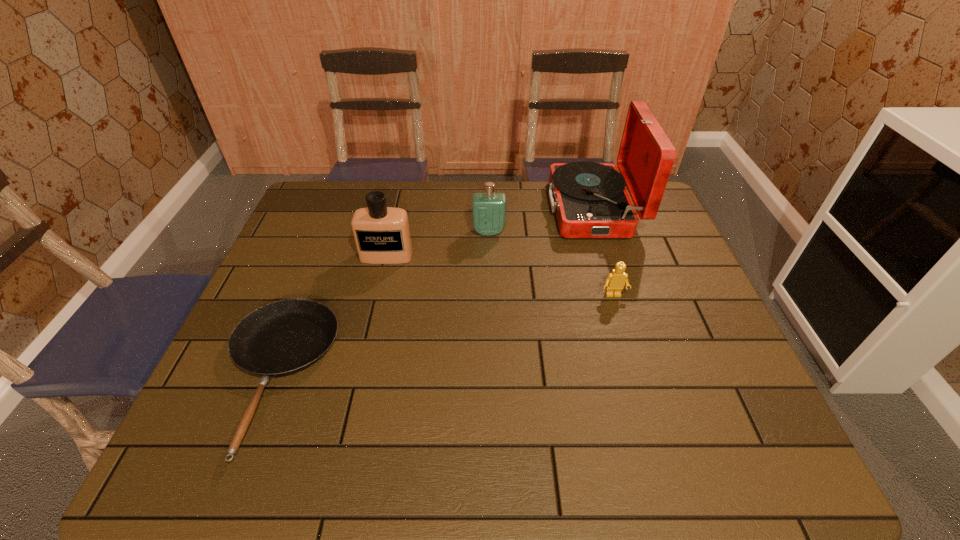
This screenshot has height=540, width=960. In order to click on phonograph_record in this screenshot , I will do `click(590, 199)`.

I want to click on the left perfume, so click(382, 235).

Identify the location of the second tallest object. (382, 235).

The image size is (960, 540). Identify the location of the third object from left to right. (489, 208).

Identify the location of the third shortest object. (489, 208).

At what (x,y) coordinates should I click in order to perform the action: click on the fourth farthest object. Please return your answer as a coordinate pair (x, y). The height and width of the screenshot is (540, 960). Looking at the image, I should click on (615, 281).

Identify the location of Lego. (615, 281).

Where is `the nearest object`? This screenshot has height=540, width=960. the nearest object is located at coordinates (284, 337).

I want to click on the shortest object, so click(284, 337).

The image size is (960, 540). Find the location of `vacant area situated 0.340m on the front-facing side of the tallest object`. vacant area situated 0.340m on the front-facing side of the tallest object is located at coordinates (447, 209).